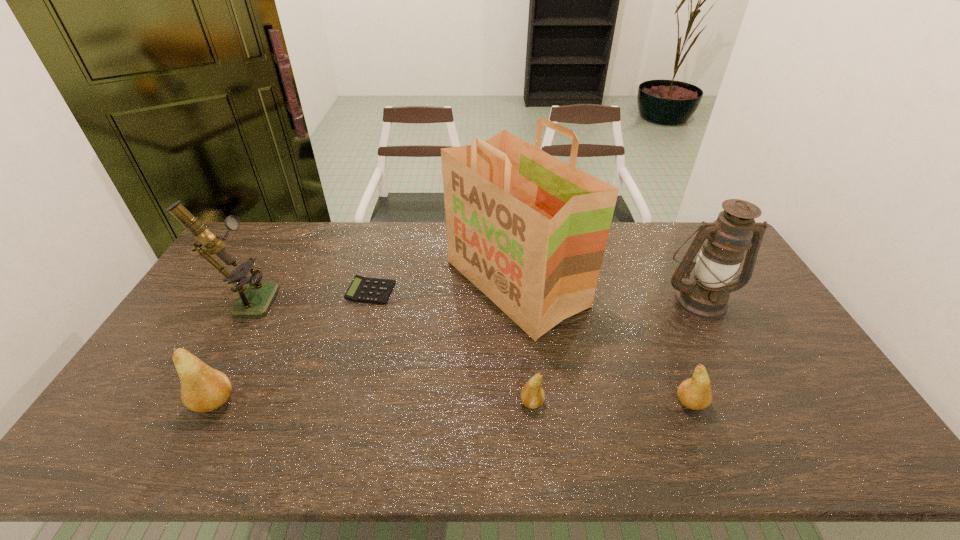
Find the location of `the tallest pear`. the tallest pear is located at coordinates (203, 389).

At what (x,y) coordinates should I click in order to perform the action: click on the fourth tallest object. Please return your answer as a coordinate pair (x, y). Image resolution: width=960 pixels, height=540 pixels. Looking at the image, I should click on (x=203, y=389).

Where is `the second shortest object`? Image resolution: width=960 pixels, height=540 pixels. the second shortest object is located at coordinates (532, 395).

Identify the location of the shortest pear. (532, 395).

Where is `the second object from right to left`? The width and height of the screenshot is (960, 540). the second object from right to left is located at coordinates (695, 393).

Where is `the second tallest pear`? the second tallest pear is located at coordinates (695, 393).

Identify the location of calculator. This screenshot has height=540, width=960. (362, 289).

Identify the location of the fifth object from right to left. This screenshot has width=960, height=540. (362, 289).

I want to click on grocery bag, so pos(528,230).

This screenshot has height=540, width=960. I want to click on microscope, so click(255, 299).